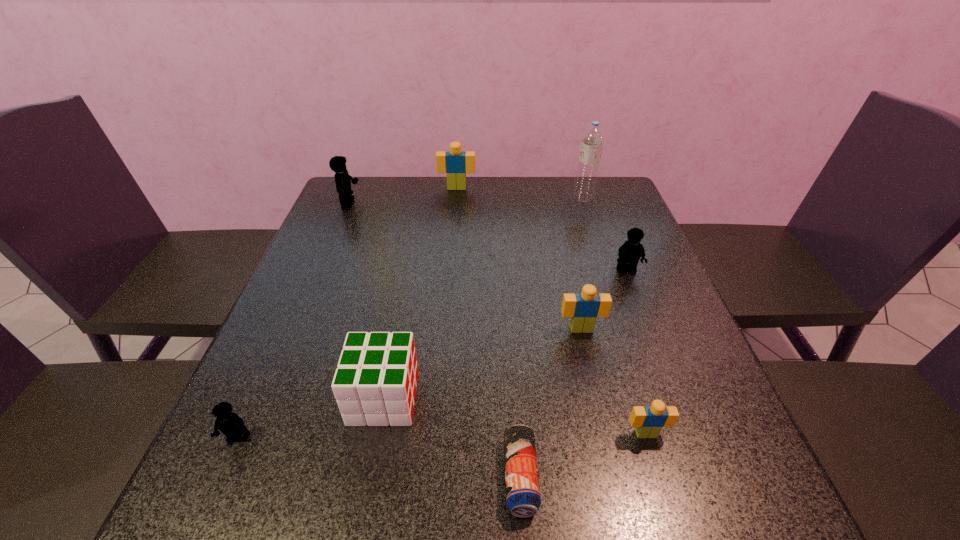
What are the coordinates of `vacant space situated 0.170m on the red face of the cube` in the screenshot? It's located at (508, 398).

Image resolution: width=960 pixels, height=540 pixels. I want to click on free space located on the face of the smallest beige Lego, so click(x=668, y=507).

Locate an element on the screen. vacant space located 0.080m on the front-facing side of the smallest yellow Lego is located at coordinates (212, 497).

In order to click on vacant space located on the back of the fifth object from left to right in this screenshot , I will do `click(512, 348)`.

In order to click on water bottle positioned at the far edge in this screenshot , I will do `click(592, 140)`.

You are a GUI agent. You are given a task and a screenshot of the screen. Output one action in this format:
    pyautogui.click(x=<x>, y=<y>)
    Task: Click on the object that is at the near edge
    This screenshot has width=960, height=540.
    Given the screenshot: What is the action you would take?
    pyautogui.click(x=523, y=499)

This screenshot has width=960, height=540. Find the location of `water bottle that is at the right edge`. water bottle that is at the right edge is located at coordinates (592, 140).

Where is `object situated at the far left corner`? This screenshot has width=960, height=540. object situated at the far left corner is located at coordinates (337, 164).

The height and width of the screenshot is (540, 960). Find the location of `object present at the far right corner`. object present at the far right corner is located at coordinates (592, 140).

In the image, there is a desktop. Identify the location of vacant space at the far edge. (420, 181).